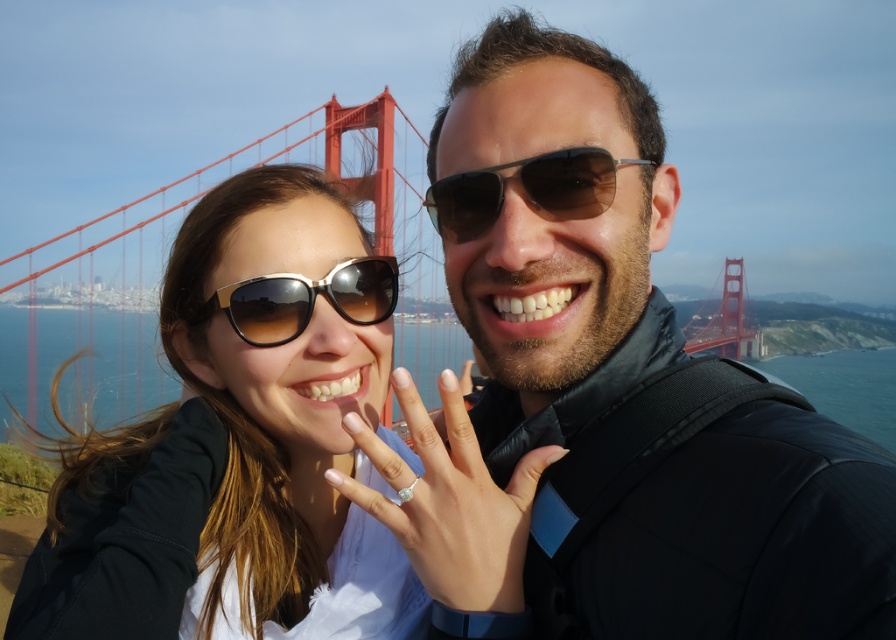
Question: Which of the following is the closest to the observer?

Choices:
 (A) gold gradient plastic sunglasses at center
 (B) matte black sunglasses at upper center
 (C) brown reflective sunglasses at center

Answer: (B)

Question: From the image, what is the correct spatial relationship of clear acrylic ring at center in relation to red painted steel bridge at center?

Choices:
 (A) below
 (B) above

Answer: (B)

Question: Among these points, which one is farthest from the camera?

Choices:
 (A) (207, 566)
 (B) (518, 577)
 (C) (695, 348)

Answer: (C)

Question: From the image, what is the correct spatial relationship of matte black sunglasses at upper center in relation to gold gradient plastic sunglasses at center?

Choices:
 (A) above
 (B) below

Answer: (B)

Question: Which point is farther to the camera?

Choices:
 (A) red painted steel bridge at center
 (B) clear acrylic ring at center
 (C) gold gradient plastic sunglasses at center
 (D) matte black sunglasses at upper center

Answer: (C)

Question: Is brown reflective sunglasses at center to the left of gold gradient plastic sunglasses at center from the viewer's perspective?

Choices:
 (A) no
 (B) yes

Answer: (A)